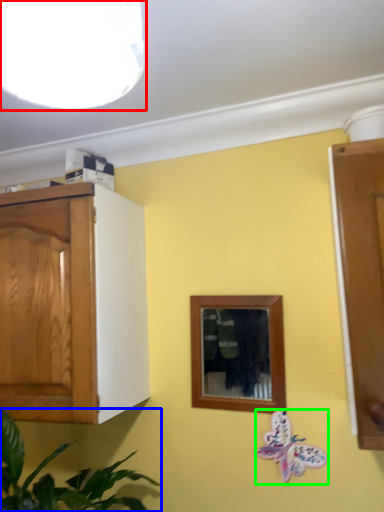
Question: Which object is positioned farthest from light fixture (highlighted by a red box)? Select from houseplant (highlighted by a blue box) and butterfly (highlighted by a green box).

Choices:
 (A) houseplant
 (B) butterfly

Answer: (B)